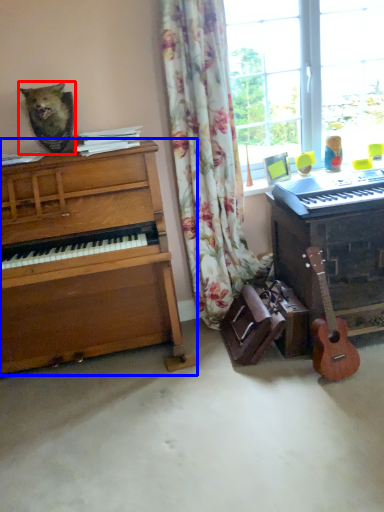
Question: Which object is closer to the camera taking this photo, animal (highlighted by a red box) or piano (highlighted by a blue box)?

Choices:
 (A) animal
 (B) piano

Answer: (B)